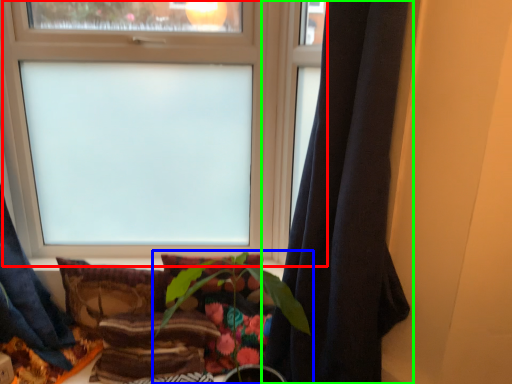
Question: Based on their relative distances, which object is farther from window (highlighted by a red box)? Choose from houseplant (highlighted by a blue box) and curtain (highlighted by a green box).

Choices:
 (A) houseplant
 (B) curtain

Answer: (B)